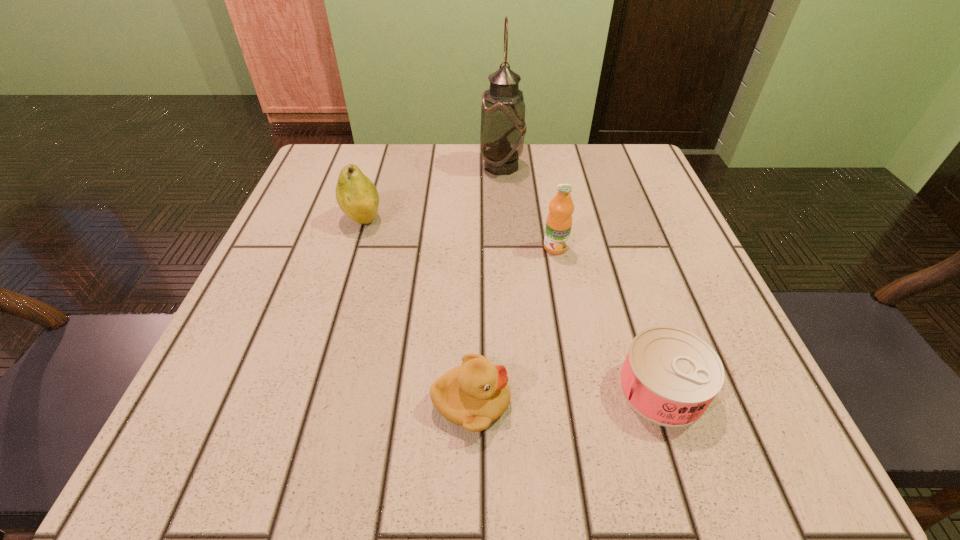
What are the coordinates of `vacant space that is in between the tallest object and the second farthest object` in the screenshot? It's located at point(432,193).

The width and height of the screenshot is (960, 540). I want to click on empty space between the second farthest object and the fourth tallest object, so click(417, 312).

The image size is (960, 540). In order to click on free area in between the orange juice and the can in this screenshot , I will do [609, 318].

Locate an element on the screen. The width and height of the screenshot is (960, 540). empty space that is in between the fourth nearest object and the third nearest object is located at coordinates click(x=459, y=234).

Find the location of a particular element. The image size is (960, 540). vacant area between the orange juice and the shortest object is located at coordinates (609, 318).

What are the coordinates of `empty location between the can and the leftmost object` in the screenshot? It's located at (512, 304).

Find the location of a particular element. the second closest object relative to the fourth nearest object is located at coordinates (559, 220).

Select which object is the fourth closest to the rightmost object. Please provide its 2D coordinates. Your answer should be formatted as a tuple, i.e. [(x, y)], where the tuple contains the x and y coordinates of a point satisfying the conditions above.

[(503, 127)]

Where is `vacant space that satisfies the following two spatial constraints: 1. on the front side of the pear; 2. on the right side of the shortest object`? Image resolution: width=960 pixels, height=540 pixels. vacant space that satisfies the following two spatial constraints: 1. on the front side of the pear; 2. on the right side of the shortest object is located at coordinates (311, 388).

Where is `free space that satisfies the following two spatial constraints: 1. on the label of the second object from right to left; 2. at the beak of the duckling`? This screenshot has height=540, width=960. free space that satisfies the following two spatial constraints: 1. on the label of the second object from right to left; 2. at the beak of the duckling is located at coordinates tap(584, 402).